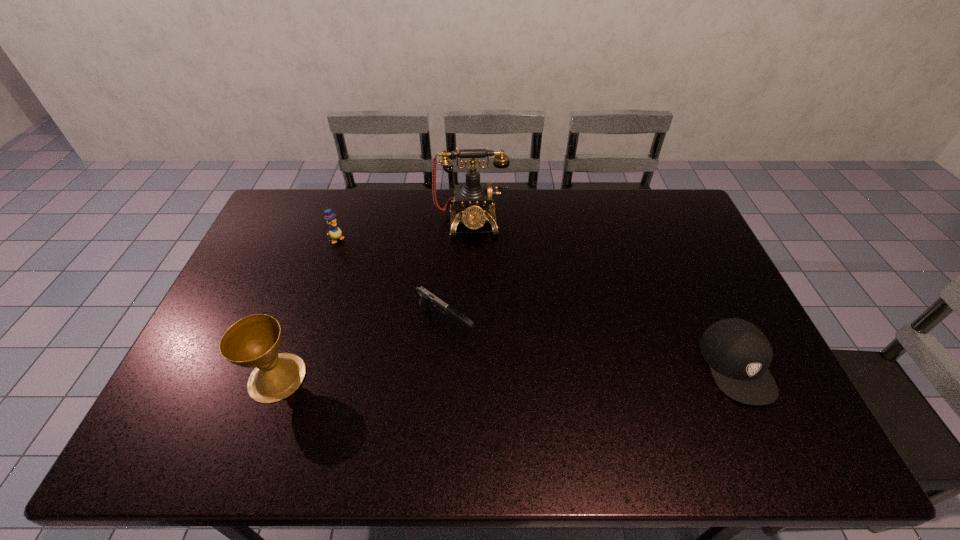
You are a GUI agent. You are given a task and a screenshot of the screen. Output one action in this format:
    pyautogui.click(x=<x>, y=<y>)
    Task: Click on the chalice
    
    Given the screenshot: What is the action you would take?
    pyautogui.click(x=254, y=341)

This screenshot has width=960, height=540. In order to click on cap in this screenshot , I will do `click(738, 353)`.

You are a GUI agent. You are given a task and a screenshot of the screen. Output one action in this format:
    pyautogui.click(x=<x>, y=<y>)
    Task: Click on the duckling
    The width and height of the screenshot is (960, 540).
    Given the screenshot: What is the action you would take?
    pyautogui.click(x=335, y=232)

Identify the location of gun. The width and height of the screenshot is (960, 540). (427, 297).

The height and width of the screenshot is (540, 960). In order to click on the tallest object in this screenshot , I will do `click(473, 197)`.

Identify the location of vacant region located on the back of the second tallest object. (314, 276).

The height and width of the screenshot is (540, 960). What are the coordinates of `free region located 0.200m on the face of the duckling, where the monocle is placed` in the screenshot? It's located at (374, 274).

I want to click on vacant area situated on the face of the duckling, where the monocle is placed, so click(372, 273).

This screenshot has width=960, height=540. Find the location of `free space located 0.070m on the face of the duckling, where the monocle is placed`. free space located 0.070m on the face of the duckling, where the monocle is placed is located at coordinates (352, 254).

This screenshot has height=540, width=960. Find the location of `vacant space positioned at the muzzle end of the shortest object`. vacant space positioned at the muzzle end of the shortest object is located at coordinates (525, 377).